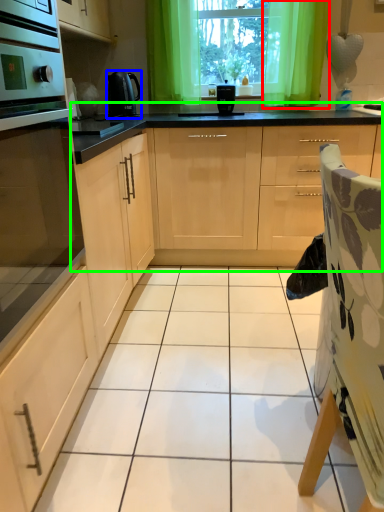
Question: Estimate the real-world distances between objects in this image. Which object is closer to curtain (highlighted by a red box), kitchen appliance (highlighted by a blue box) or cabinetry (highlighted by a green box)?

Choices:
 (A) kitchen appliance
 (B) cabinetry

Answer: (B)